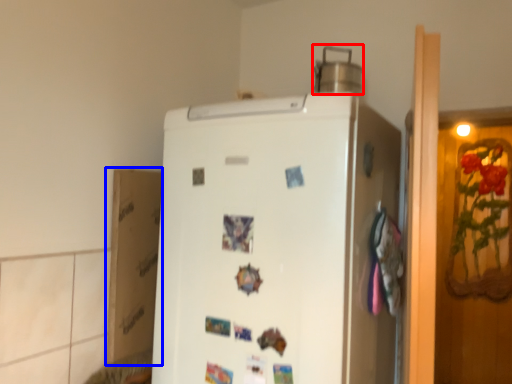
Question: Which object appears closest to the camera in this image, appliance (highlighted by a red box) or cardboard box (highlighted by a blue box)?

Choices:
 (A) appliance
 (B) cardboard box

Answer: (B)